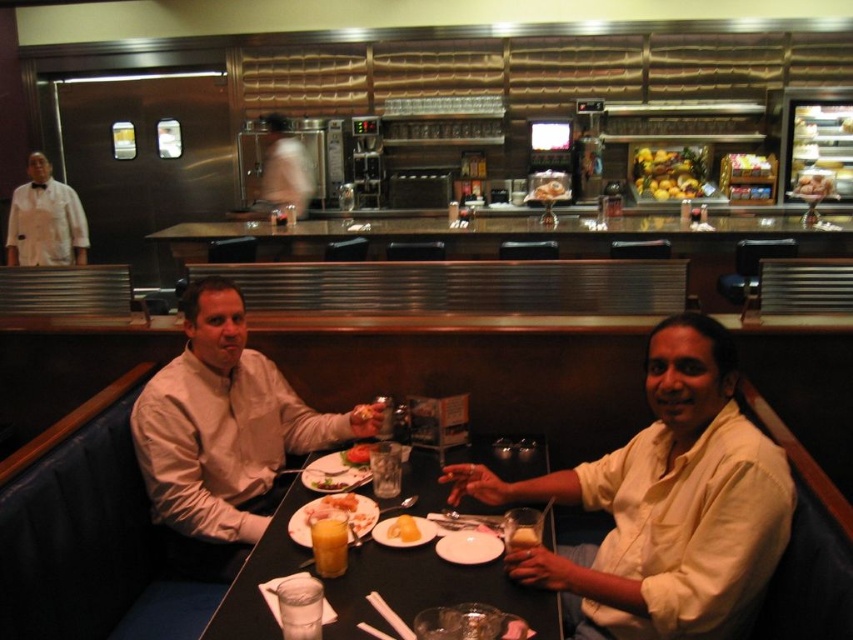
You are a GUI agent. You are given a task and a screenshot of the screen. Output one action in this format:
    pyautogui.click(x=<x>, y=<y>)
    Task: Click on the golden brown bread at right
    
    Given the screenshot: What is the action you would take?
    pyautogui.click(x=814, y=182)

Is point (820, 188) closer to camera compared to point (514, 538)?

No, (820, 188) is behind (514, 538).

Where is `golden brown bread at right`? Image resolution: width=853 pixels, height=640 pixels. golden brown bread at right is located at coordinates pyautogui.click(x=814, y=182).

Can you confirm if matte brown bread at center is thinner than smooth yellow butter at table center?

In fact, matte brown bread at center might be wider than smooth yellow butter at table center.

Where is `matte brown bread at center`? The height and width of the screenshot is (640, 853). matte brown bread at center is located at coordinates (549, 189).

Which is more to the right, white matte plate at center or matte white plate at center?

white matte plate at center is more to the right.

You are a GUI agent. You are given a task and a screenshot of the screen. Output one action in this format:
    pyautogui.click(x=<x>, y=<y>)
    Task: Click on the white matte plate at center
    This screenshot has width=853, height=640.
    Given the screenshot: What is the action you would take?
    pyautogui.click(x=468, y=547)